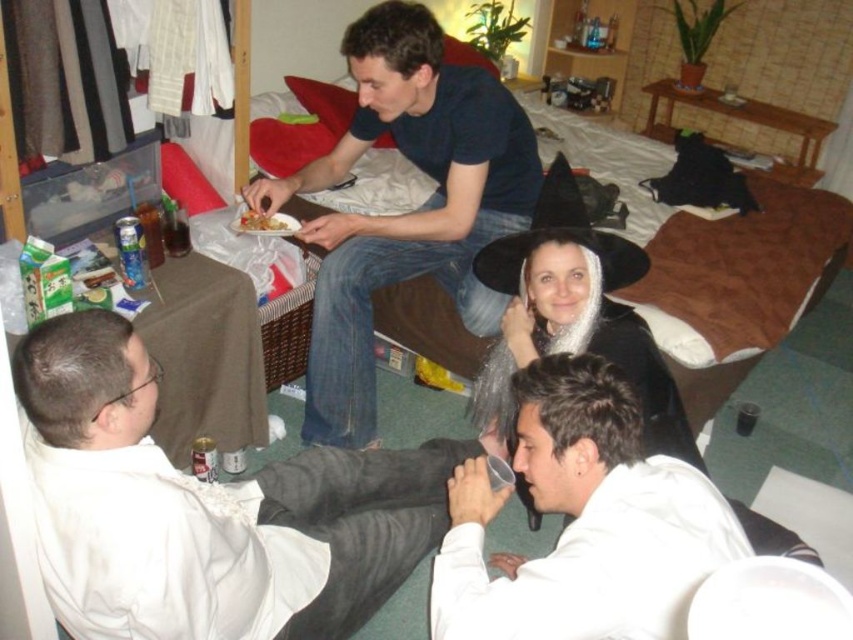
Looking at this image, who is higher up, white matte shirt at lower right or shiny metallic plate at center?

shiny metallic plate at center is higher up.

Is white matte shirt at lower right to the right of shiny metallic plate at center from the viewer's perspective?

Correct, you'll find white matte shirt at lower right to the right of shiny metallic plate at center.

Is point (695, 577) farther from camera compared to point (288, 221)?

No, (695, 577) is in front of (288, 221).

I want to click on white matte shirt at lower right, so click(583, 522).

Between point (148, 524) and point (509, 634), which one is positioned in front?

Point (509, 634) is more forward.

Does point (350, 630) lie behind point (660, 516)?

Yes, it is.

Locate an element on the screen. The image size is (853, 640). white matte shirt at lower left is located at coordinates (206, 508).

Is dark blue t-shirt at upper center bigger than shiny metallic plate at center?

Correct, dark blue t-shirt at upper center is larger in size than shiny metallic plate at center.

Which is behind, point (486, 218) or point (283, 212)?

Positioned behind is point (283, 212).

Which is in front, point (317, 321) or point (242, 227)?

Point (317, 321) is more forward.

Where is `dark blue t-shirt at upper center`? The width and height of the screenshot is (853, 640). dark blue t-shirt at upper center is located at coordinates (405, 212).